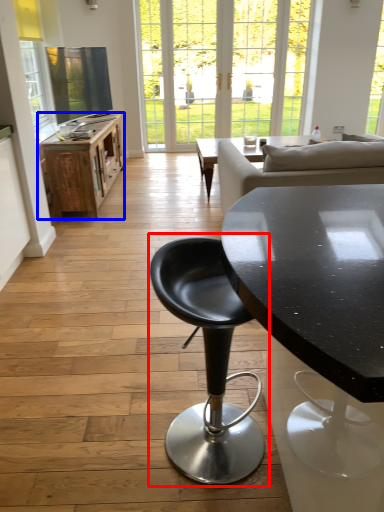
Question: Among these objects, which one is farthest to the camera, chair (highlighted by a red box) or table (highlighted by a blue box)?

Choices:
 (A) chair
 (B) table

Answer: (B)